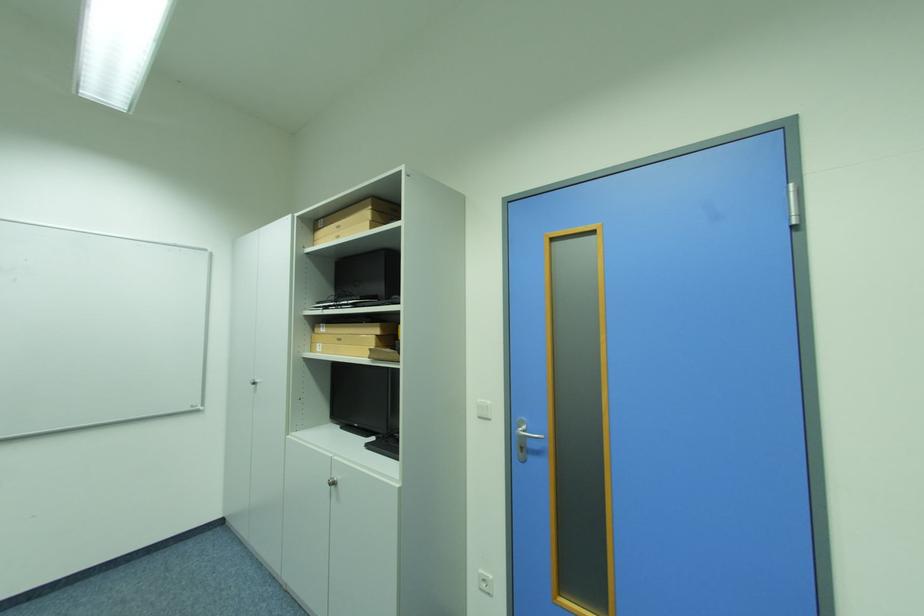
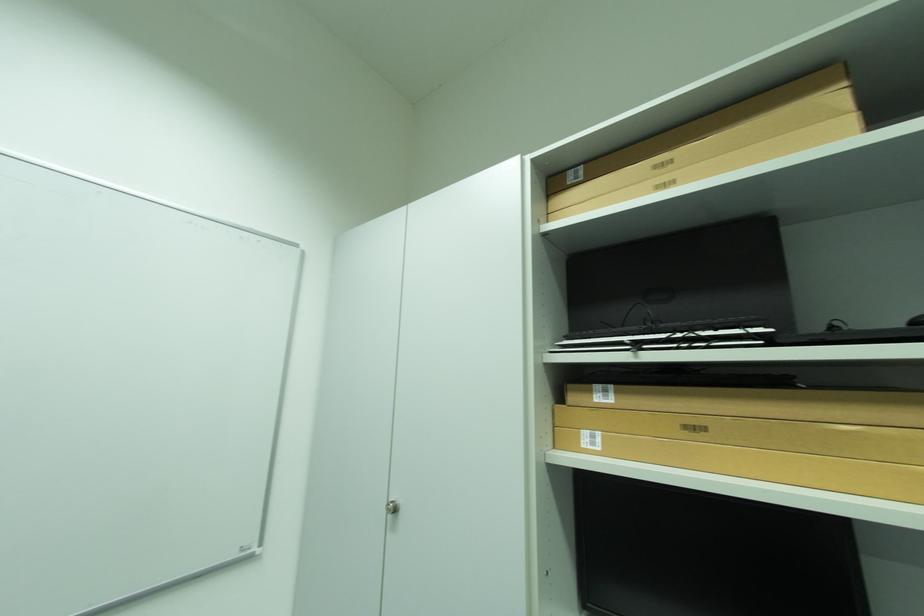
Locate, in the second image, the point that corresponds to (261,386) in the first image.

(394, 512)